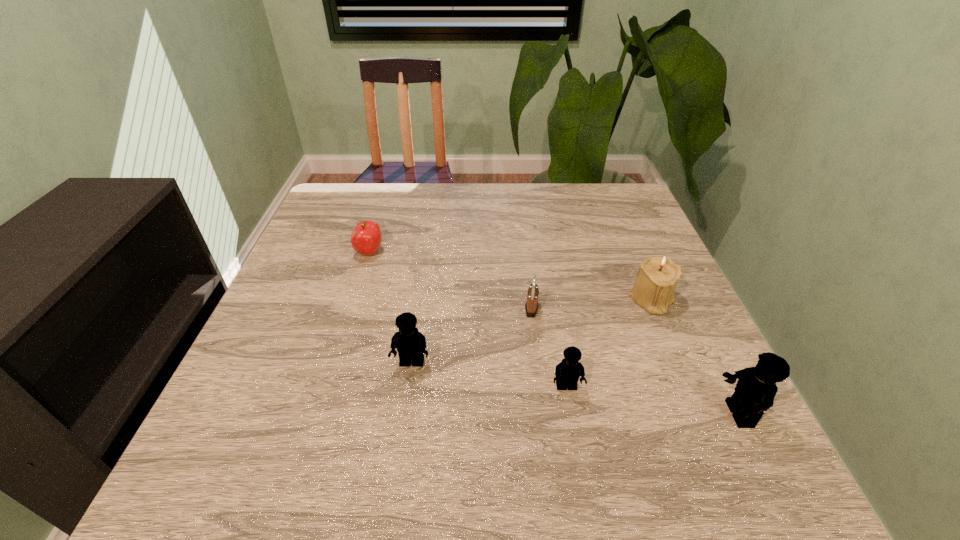
This screenshot has width=960, height=540. What are the coordinates of `unoccupied position between the candle_holder and the second Lego from left to right` in the screenshot? It's located at (609, 343).

The image size is (960, 540). I want to click on empty space between the farthest object and the second Lego from right to left, so click(x=468, y=320).

You are a GUI agent. You are given a task and a screenshot of the screen. Output one action in this format:
    pyautogui.click(x=<x>, y=<y>)
    Task: Click on the vacant space that is in between the padlock and the candle_holder
    The image size is (960, 540).
    Given the screenshot: What is the action you would take?
    pyautogui.click(x=591, y=304)

What are the coordinates of `empty space between the farthest Lego and the padlock` in the screenshot? It's located at pyautogui.click(x=471, y=336).

Find the location of `free space between the leftmost object and the second Lego from right to left`. free space between the leftmost object and the second Lego from right to left is located at coordinates (468, 320).

In order to click on free space between the apple and the fourth object from left to right in this screenshot , I will do point(468,320).

What are the coordinates of `vacant space that is in between the rightmost Lego and the second Lego from right to left` in the screenshot? It's located at (652, 400).

Identify the location of object that stands as the closest to the rightmost Lego. (657, 277).

At what (x,y) coordinates should I click in order to perform the action: click on object that is the fifth closest to the farthest Lego. Please return your answer as a coordinate pair (x, y). Image resolution: width=960 pixels, height=540 pixels. Looking at the image, I should click on (755, 390).

Locate which Lego ranks third in proximity to the fourth object from right to left. Please provide its 2D coordinates. Your answer should be formatted as a tuple, i.e. [(x, y)], where the tuple contains the x and y coordinates of a point satisfying the conditions above.

[(755, 390)]